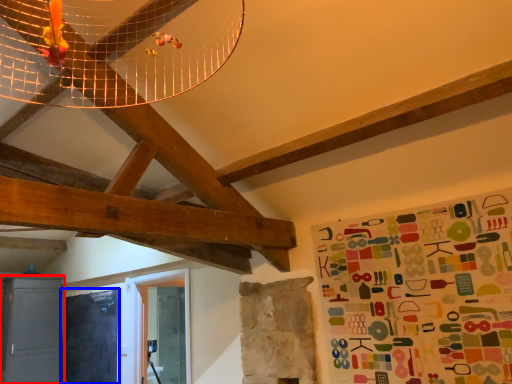
Question: Which object appears farthest to the camera in this image, cabinetry (highlighted by a red box) or bulletin board (highlighted by a blue box)?

Choices:
 (A) cabinetry
 (B) bulletin board

Answer: (A)